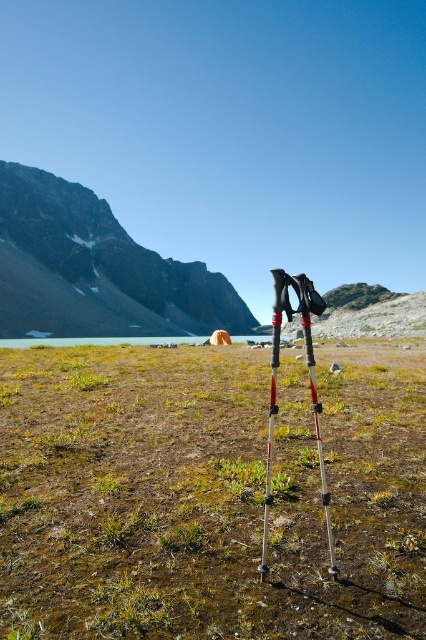
Question: Considering the real-world distances, which object is farthest from the rugged stone mountain at upper left?

Choices:
 (A) translucent plastic ski pole at center
 (B) green grass at center

Answer: (A)

Question: Can you confirm if rugged stone mountain at upper left is positioned above translucent plastic ski pole at center?

Choices:
 (A) no
 (B) yes

Answer: (B)

Question: Which of the following is the farthest from the observer?

Choices:
 (A) translucent plastic ski pole at center
 (B) rugged stone mountain at upper left

Answer: (B)

Question: Is green grass at center to the right of polished aluminum ski pole at center from the viewer's perspective?

Choices:
 (A) yes
 (B) no

Answer: (B)

Question: Which object is closer to the camera taking this photo?

Choices:
 (A) translucent plastic ski pole at center
 (B) green grass at center
 (C) polished aluminum ski pole at center
 (D) rugged stone mountain at upper left

Answer: (B)

Question: Can you confirm if green grass at center is thinner than polished aluminum ski pole at center?

Choices:
 (A) yes
 (B) no

Answer: (B)